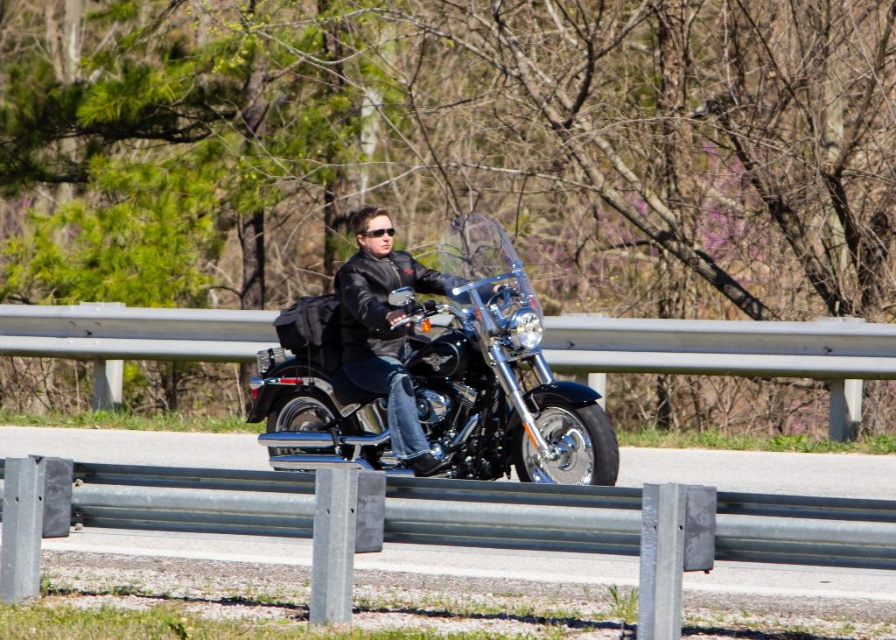
You are standing at the point marked as point (356, 408) and want to take a photo of the motorcycle. If your camera can focus on objects up to 40 feet away, will it be able to capture the motorcycle clearly?

The distance between point (356, 408) and the camera is 36.78 feet, which is within the camera focus range of 40 feet. Therefore, the camera can capture the motorcycle clearly.

You are a GPS device guiding a drone to capture aerial footage of the motorcyclist. The drone must fly from point A to point B without crossing any obstacles. Given that point A is at coordinate point(502, 298) and point B is at coordinate point(389, 230), which point should the drone take off from to ensure it stays above the motorcyclist and avoids obstacles like the guardrail?

The drone should take off from point A at coordinate point(502, 298) because it is in front of point B at coordinate point(389, 230). This ensures the drone stays ahead of the motorcyclist and avoids obstacles like the guardrail.